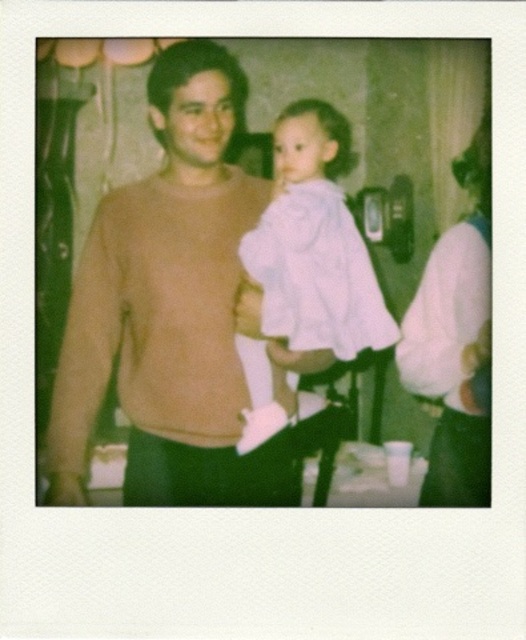
Question: Can you confirm if white soft fabric dress at center is smaller than white fabric dress at right?

Choices:
 (A) yes
 (B) no

Answer: (A)

Question: Can you confirm if white soft fabric dress at center is positioned below white fabric dress at right?

Choices:
 (A) yes
 (B) no

Answer: (A)

Question: Estimate the real-world distances between objects in this image. Which object is farther from the brown sweater at center?

Choices:
 (A) white soft fabric dress at center
 (B) white fabric dress at right

Answer: (B)

Question: Which point appears farthest from the camera in this image?

Choices:
 (A) (452, 332)
 (B) (368, 292)

Answer: (A)

Question: Which object is the closest to the white soft fabric dress at center?

Choices:
 (A) white fabric dress at right
 (B) brown sweater at center

Answer: (B)

Question: Is brown sweater at center to the right of white soft fabric dress at center from the viewer's perspective?

Choices:
 (A) yes
 (B) no

Answer: (B)